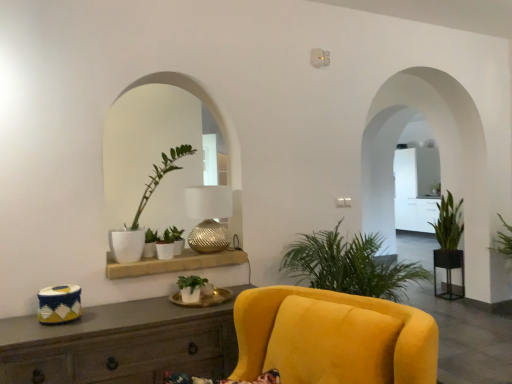
Locate an element on the screen. The width and height of the screenshot is (512, 384). vacant space in front of green matte plant at center, the sixth houseplant when ordered from right to left is located at coordinates (141, 261).